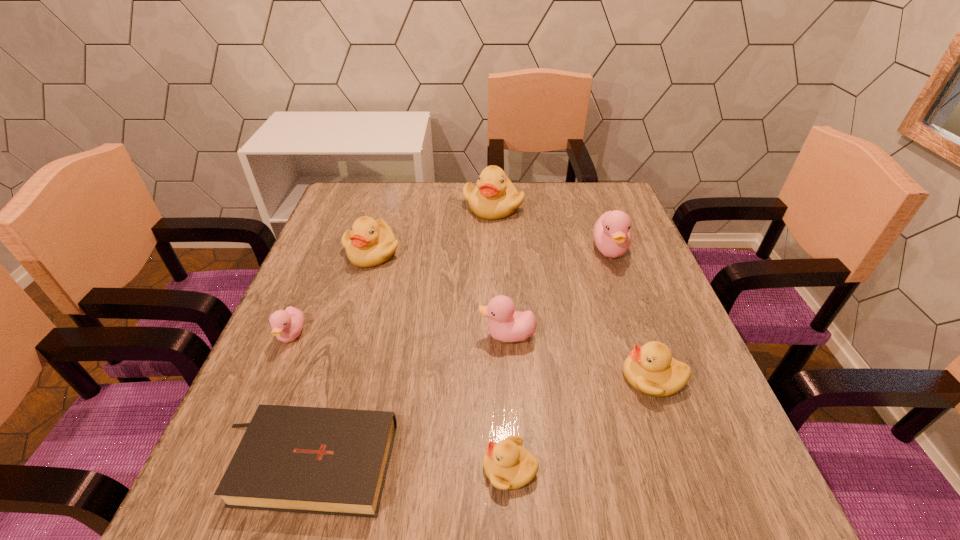
Where is `empty space between the biggest yellow duckling and the rightmost pink duckling`? empty space between the biggest yellow duckling and the rightmost pink duckling is located at coordinates (551, 228).

Locate an element on the screen. The image size is (960, 540). vacant point located between the biggest yellow duckling and the second biggest pink duckling is located at coordinates 500,271.

Where is `free space between the second biggest pink duckling and the leftmost pink duckling`? Image resolution: width=960 pixels, height=540 pixels. free space between the second biggest pink duckling and the leftmost pink duckling is located at coordinates (399, 335).

This screenshot has height=540, width=960. I want to click on empty location between the farthest pink duckling and the shortest object, so click(x=457, y=357).

Find the location of a particular element. free space between the biggest yellow duckling and the farthest pink duckling is located at coordinates (551, 228).

Where is `vacant area that lies between the biggest pink duckling and the farthest object`? Image resolution: width=960 pixels, height=540 pixels. vacant area that lies between the biggest pink duckling and the farthest object is located at coordinates (551, 228).

You are a GUI agent. You are given a task and a screenshot of the screen. Output one action in this format:
    pyautogui.click(x=<x>, y=<y>)
    Task: Click on the vacant point located between the leftmost duckling and the shortest duckling
    This screenshot has width=960, height=540.
    Given the screenshot: What is the action you would take?
    pyautogui.click(x=400, y=402)

I want to click on empty space that is in between the leftmost pink duckling and the second duckling from left to right, so click(332, 293).

The image size is (960, 540). What are the coordinates of `free space between the sixth duckling from right to left and the second smallest pink duckling` in the screenshot? It's located at (440, 294).

The image size is (960, 540). I want to click on vacant region between the second duckling from left to right and the shortest object, so click(x=338, y=357).